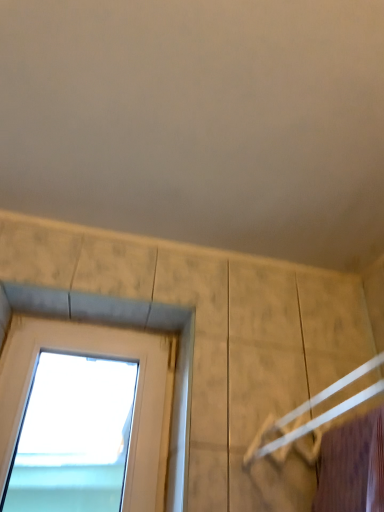
I want to click on brown fabric curtain at lower right, so click(x=345, y=466).

The height and width of the screenshot is (512, 384). Describe the element at coordinates (345, 466) in the screenshot. I see `brown fabric curtain at lower right` at that location.

The height and width of the screenshot is (512, 384). What are the coordinates of `brown fabric curtain at lower right` in the screenshot? It's located at (345, 466).